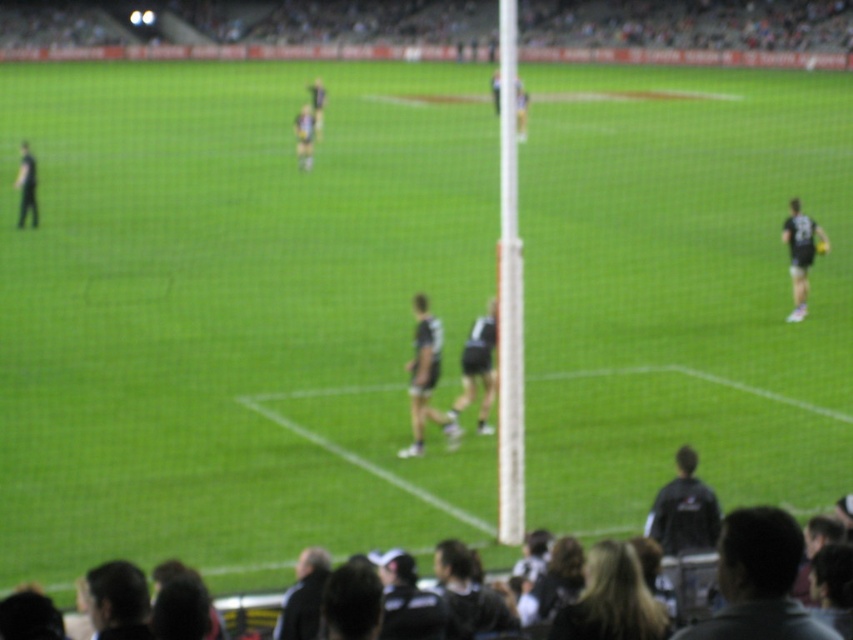
Question: Which object is positioned farthest from the dark gray jersey at lower center?

Choices:
 (A) black jersey at right
 (B) black jersey at lower right

Answer: (A)

Question: Is dark gray jacket at lower right closer to camera compared to black jersey at lower right?

Choices:
 (A) no
 (B) yes

Answer: (B)

Question: Which object is farther from the camera taking this photo?

Choices:
 (A) dark gray jacket at lower right
 (B) dark hair at upper center
 (C) black jersey at lower right
 (D) black jersey at right

Answer: (B)

Question: Considering the relative positions of black jersey at center and dark gray jersey at lower center in the image provided, where is black jersey at center located with respect to dark gray jersey at lower center?

Choices:
 (A) above
 (B) below

Answer: (A)

Question: Is black jersey at center to the right of black uniform at left from the viewer's perspective?

Choices:
 (A) yes
 (B) no

Answer: (A)

Question: Which point appears farthest from the camera in this image?

Choices:
 (A) (306, 604)
 (B) (798, 564)
 (C) (393, 4)

Answer: (C)